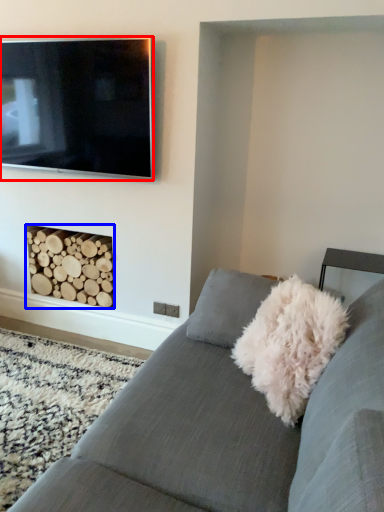
Question: Which point is further to the camera, television (highlighted by a red box) or fireplace (highlighted by a blue box)?

Choices:
 (A) television
 (B) fireplace

Answer: (B)